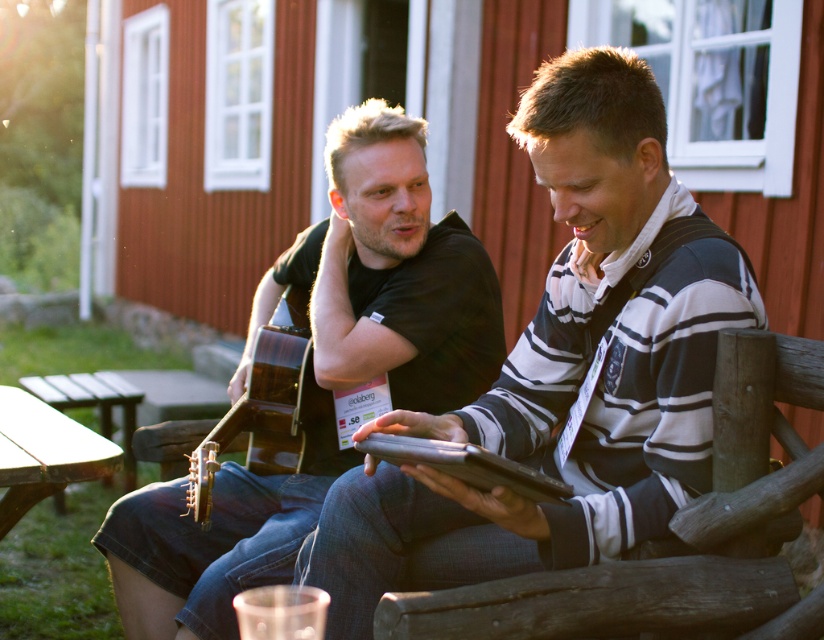
Does wooden acoustic guitar at center have a greater height compared to wooden picnic table at lower left?

Yes.

Is wooden acoustic guitar at center bigger than wooden picnic table at lower left?

No.

Identify the location of wooden acoustic guitar at center. (265, 413).

This screenshot has height=640, width=824. I want to click on wooden acoustic guitar at center, so click(265, 413).

Looking at this image, who is positioned more to the left, black matte guitar at left or wooden picnic table at lower left?

From the viewer's perspective, wooden picnic table at lower left appears more on the left side.

Does black matte guitar at left have a greater width compared to wooden picnic table at lower left?

Correct, the width of black matte guitar at left exceeds that of wooden picnic table at lower left.

Is point (385, 330) less distant than point (5, 444)?

Yes, point (385, 330) is in front of point (5, 444).

The width and height of the screenshot is (824, 640). What are the coordinates of `black matte guitar at left` in the screenshot? It's located at (387, 275).

Can you confirm if striped cotton sweater at center is positioned below wooden picnic table at lower left?

No, striped cotton sweater at center is not below wooden picnic table at lower left.

Which is behind, point (494, 534) or point (40, 412)?

Point (40, 412)

The height and width of the screenshot is (640, 824). Find the location of `striped cotton sweater at center`. striped cotton sweater at center is located at coordinates (563, 369).